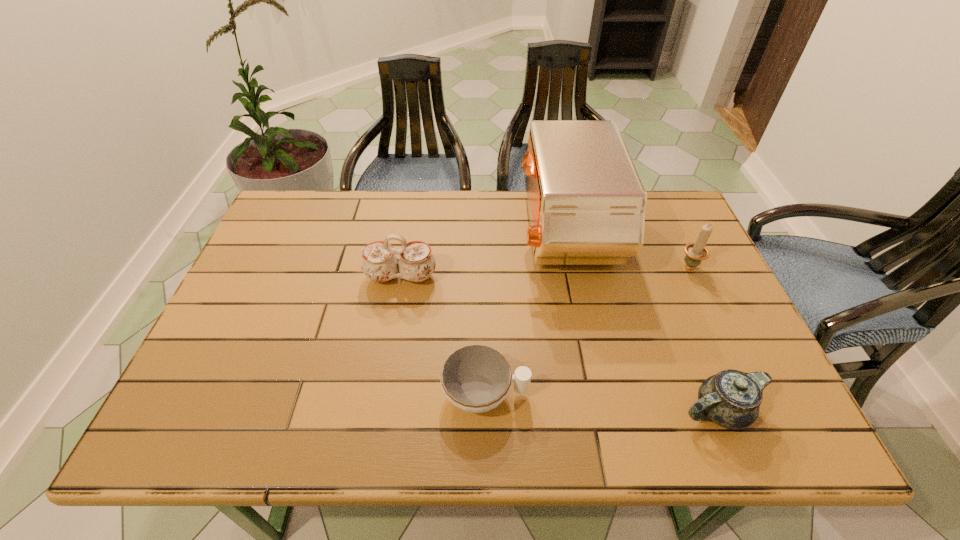
At what (x,y) coordinates should I click in order to perform the action: click on toaster oven. Please return your answer as a coordinate pair (x, y). The width and height of the screenshot is (960, 540). Looking at the image, I should click on (586, 202).

Image resolution: width=960 pixels, height=540 pixels. Identify the location of the tallest object. (586, 202).

This screenshot has width=960, height=540. What are the coordinates of `candle_holder` in the screenshot? It's located at (695, 252).

Where is `the leftmost object`? the leftmost object is located at coordinates (379, 263).

Where is `the tallest chinaware`? This screenshot has height=540, width=960. the tallest chinaware is located at coordinates (379, 263).

The width and height of the screenshot is (960, 540). What are the coordinates of `the fourth tallest object` in the screenshot? It's located at (731, 399).

In order to click on the second shortest chinaware in this screenshot , I will do `click(731, 399)`.

At what (x,y) coordinates should I click in order to perform the action: click on the shortest chinaware. Please return your answer as a coordinate pair (x, y). The width and height of the screenshot is (960, 540). Looking at the image, I should click on (476, 378).

Where is `the shortest object`? the shortest object is located at coordinates (476, 378).

Where is `free space located 0.350m on the door side of the tallest object`? free space located 0.350m on the door side of the tallest object is located at coordinates pyautogui.click(x=400, y=234).